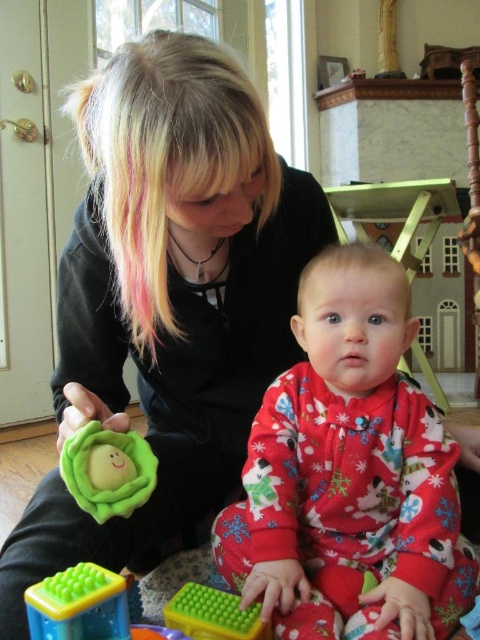
From the picture: You are a photographer setting up a shot of the scene described. You need to place a light source at the point labeled point (168, 298). What object will the light source illuminate most directly?

The light source placed at point (168, 298) will illuminate the matte black sweater at center most directly.

You are a photographer trying to capture a candid shot of the baby and the adult. You need to position yourself such that both the point at (304, 616) and the point at (111, 605) are visible in the frame. Based on their positions, which point should you prioritize placing closer to the camera to ensure both are visible?

Point (111, 605) should be placed closer to the camera because it is in front of point (304, 616). This way, both points will be visible without one blocking the other.

You are a photographer setting up a shoot in this scene. You need to place a backdrop that is 1.2 meters wide behind the two central objects. Given that the matte black sweater at center and the fluffy red pajamas at center are both at center, will the backdrop be wide enough to cover both objects without any overlap?

The matte black sweater at center is wider than the fluffy red pajamas at center. Since the backdrop is 1.2 meters wide and the sweater is the wider object, as long as the total width of both objects combined does not exceed 1.2 meters, the backdrop can cover them. However, if the sweater alone is already wider than 1.2 meters, it would not fit. The description only states the sweater is wider than the pajamas but does not provide exact measurements, so we cannot definitively answer without more information